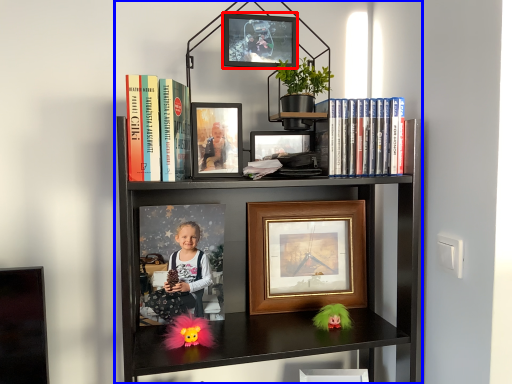
Question: Which point is closer to the camera, picture frame (highlighted by a red box) or bookcase (highlighted by a blue box)?

Choices:
 (A) picture frame
 (B) bookcase

Answer: (B)